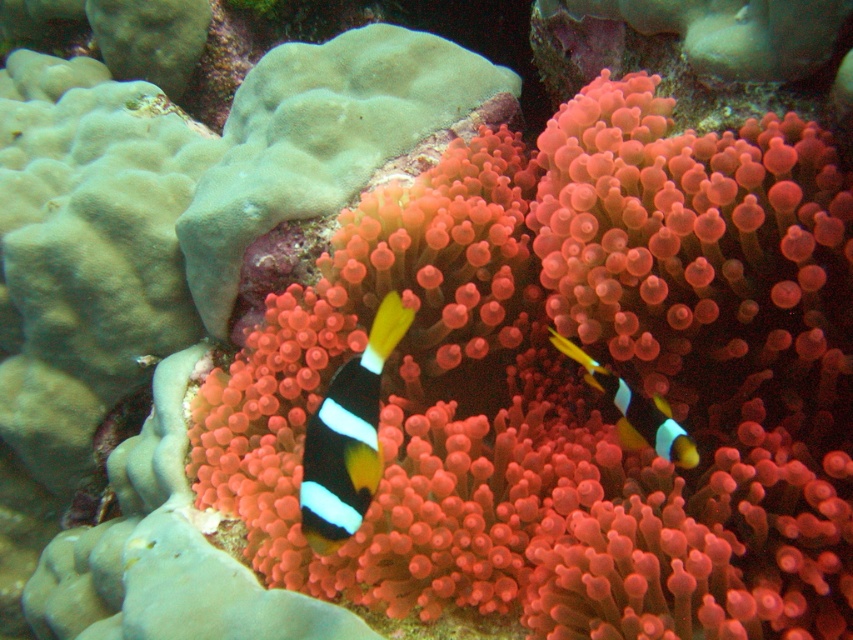
You are a scuba diver with a camera that has a maximum focus range of 1 meter. You want to take a clear photo of the black and white striped clownfish at center. Can you capture it clearly without moving closer?

The black and white striped clownfish at center is 1.02 meters away from the viewer. Since the camera can only focus up to 1 meter, the distance is slightly beyond the camera range. You need to move closer to ensure the clownfish is within the focus range.